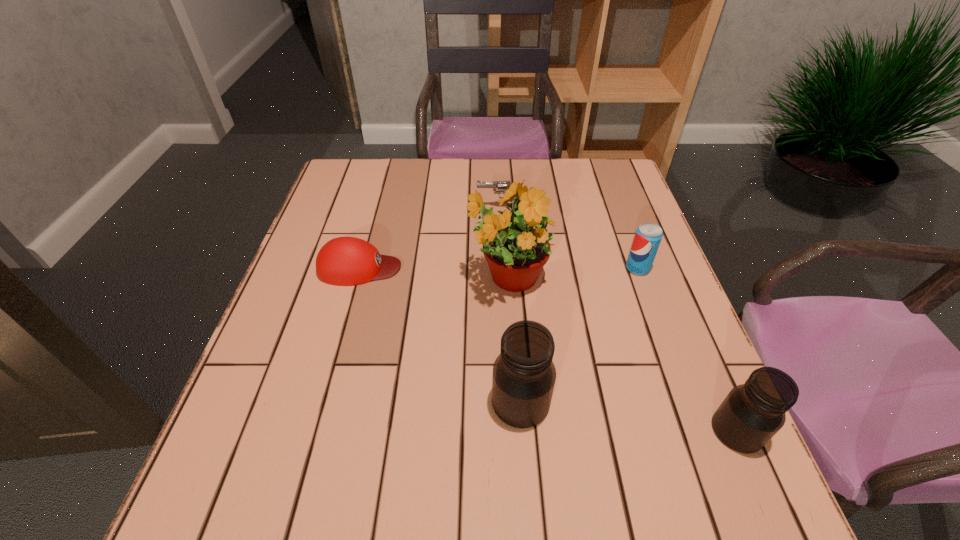
I want to click on free spot at the far edge of the desktop, so click(483, 166).

In the image, there is a desktop. At what (x,y) coordinates should I click in order to perform the action: click on vacant space at the near edge. Please return your answer as a coordinate pair (x, y). Image resolution: width=960 pixels, height=540 pixels. Looking at the image, I should click on (457, 421).

Identify the location of free location at the left edge of the desktop. [x=307, y=255].

Identify the location of vacant space at the right edge. The height and width of the screenshot is (540, 960). (612, 302).

Where is `free space at the far left corner`? This screenshot has height=540, width=960. free space at the far left corner is located at coordinates (348, 187).

In the image, there is a desktop. Where is `free space at the far right corner`? free space at the far right corner is located at coordinates (587, 192).

The height and width of the screenshot is (540, 960). Identify the location of vacant region between the leftmost object and the taller jar. (441, 335).

You are a GUI agent. You are given a task and a screenshot of the screen. Output one action in this format:
    pyautogui.click(x=<x>, y=<y>)
    Task: Click on the vacant point located between the third shortest object and the pistol
    The width and height of the screenshot is (960, 540).
    Given the screenshot: What is the action you would take?
    pyautogui.click(x=569, y=238)

Find the location of a particular element. Image resolution: width=960 pixels, height=540 pixels. free area in between the right jar and the flowerpot is located at coordinates (622, 355).

This screenshot has width=960, height=540. In order to click on vacant area between the leftmost object and the tallest object in this screenshot , I will do `click(433, 273)`.